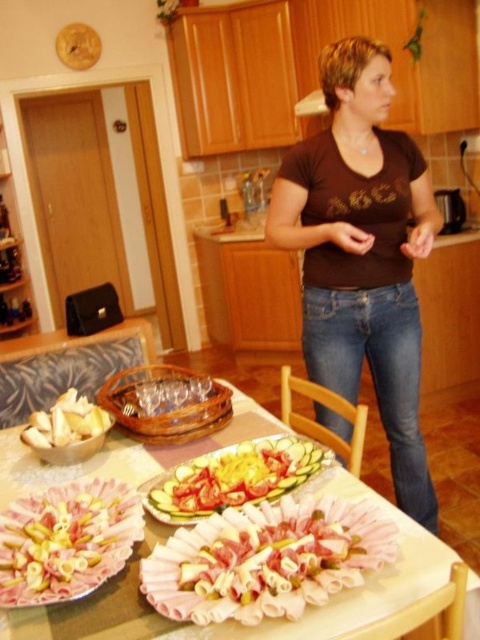
In the scene shown: You are a chef arranging a buffet table. You have a pink glossy rolled meat at center and a smooth white platter at center. You need to place a new dish between them. What is the minimum distance you should maintain between the new dish and the existing items?

The pink glossy rolled meat at center is 8.11 inches away from the smooth white platter at center. To maintain the same spacing, the new dish should be placed at least 4.05 inches away from each item.

You are a guest at a dinner party and notice the brown cotton shirt at center and the pink glossy rolled meat at center on the table. Which item takes up more space on the table?

The brown cotton shirt at center is bigger than the pink glossy rolled meat at center, so it takes up more space on the table.